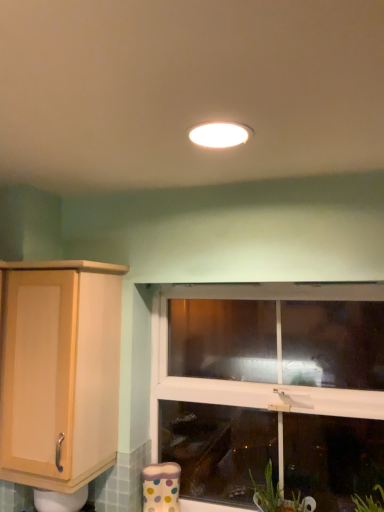
Question: Should I look upward or downward to see light wood cabinet at left?

Choices:
 (A) down
 (B) up

Answer: (A)

Question: From the image's perspective, is white glossy light fixture at center beneath light wood cabinet at left?

Choices:
 (A) yes
 (B) no

Answer: (B)

Question: Considering the relative sizes of white glossy light fixture at center and light wood cabinet at left in the image provided, is white glossy light fixture at center wider than light wood cabinet at left?

Choices:
 (A) yes
 (B) no

Answer: (B)

Question: Is white glossy light fixture at center beside light wood cabinet at left?

Choices:
 (A) no
 (B) yes

Answer: (A)

Question: Does white glossy light fixture at center have a smaller size compared to light wood cabinet at left?

Choices:
 (A) no
 (B) yes

Answer: (B)

Question: Is white glossy light fixture at center facing towards light wood cabinet at left?

Choices:
 (A) yes
 (B) no

Answer: (B)

Question: From a real-world perspective, does white glossy light fixture at center stand above light wood cabinet at left?

Choices:
 (A) yes
 (B) no

Answer: (A)

Question: From a real-world perspective, is white glossy light fixture at center beneath clear glass window at center?

Choices:
 (A) no
 (B) yes

Answer: (A)

Question: Is white glossy light fixture at center directly adjacent to clear glass window at center?

Choices:
 (A) yes
 (B) no

Answer: (B)

Question: From a real-world perspective, is white glossy light fixture at center located higher than clear glass window at center?

Choices:
 (A) yes
 (B) no

Answer: (A)

Question: Is white glossy light fixture at center oriented towards clear glass window at center?

Choices:
 (A) no
 (B) yes

Answer: (A)

Question: Does white glossy light fixture at center lie in front of clear glass window at center?

Choices:
 (A) no
 (B) yes

Answer: (B)

Question: Could clear glass window at center be considered to be inside white glossy light fixture at center?

Choices:
 (A) no
 (B) yes

Answer: (A)

Question: Can you confirm if light wood cabinet at left is shorter than clear glass window at center?

Choices:
 (A) no
 (B) yes

Answer: (B)